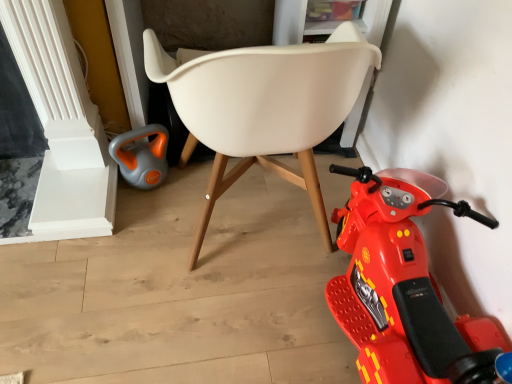
You are a GUI agent. You are given a task and a screenshot of the screen. Output one action in this format:
    pyautogui.click(x=<x>, y=<y>)
    Task: Click on the free space between white plastic chair at center and shiny plastic scooter at lower right
    This screenshot has height=384, width=512.
    Given the screenshot: What is the action you would take?
    pyautogui.click(x=280, y=327)